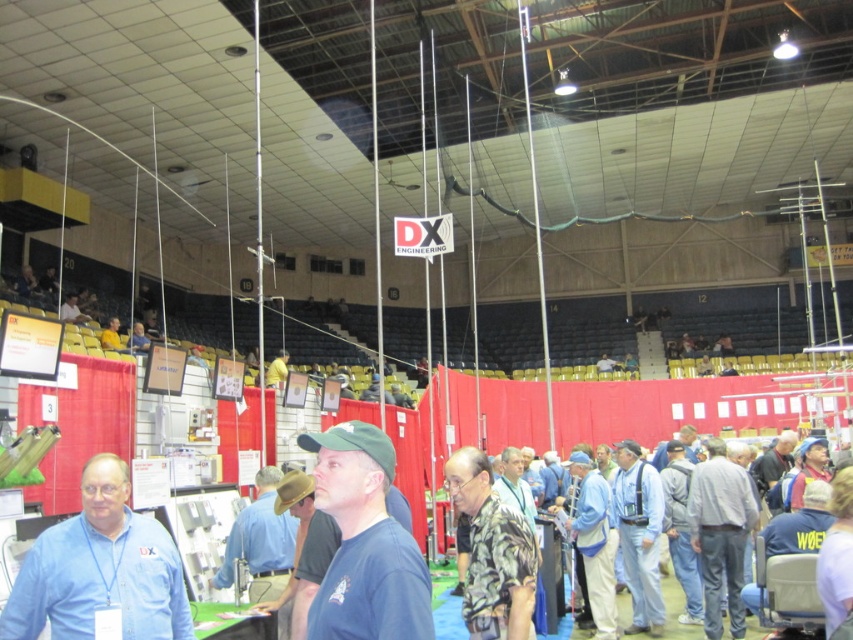
You are an attendee at the event and want to take a photo of the brown leather hat at center without including the camouflage shirt at center in the frame. Is this possible given their positions?

The camouflage shirt at center is closer to the viewer than the brown leather hat at center, so it would block the view of the hat. Therefore, it is not possible to take a photo of the brown leather hat at center without including the camouflage shirt at center in the frame.

You are an event organizer who needs to ensure there is enough space between the blue shirt at center and the yellow fabric at center for attendees to walk comfortably. What is the minimum width required for the walkway between them?

The blue shirt at center is narrower than the yellow fabric at center. To ensure a comfortable walkway, the minimum width should be at least the width of the wider object, which is the yellow fabric at center. However, specific requirements may vary based on safety standards or event guidelines.